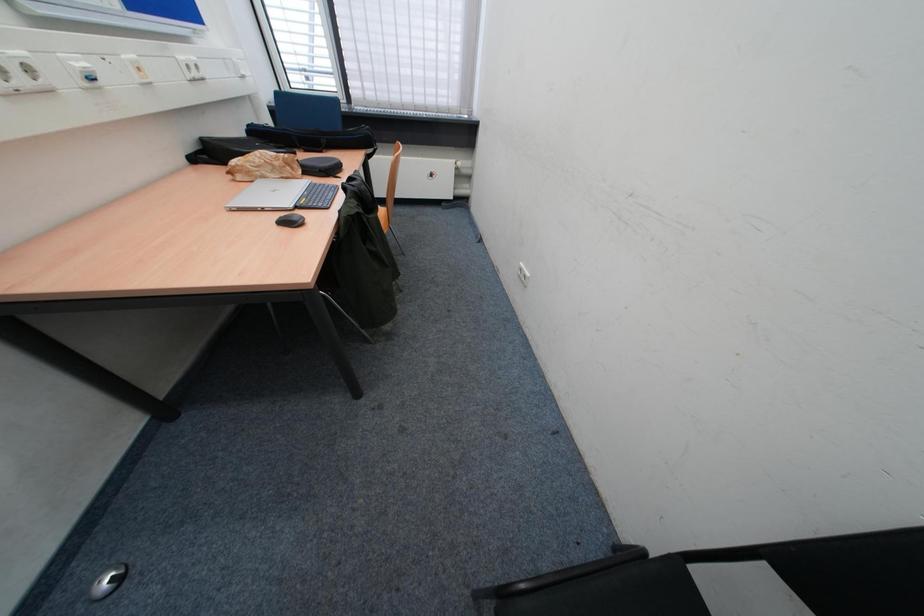
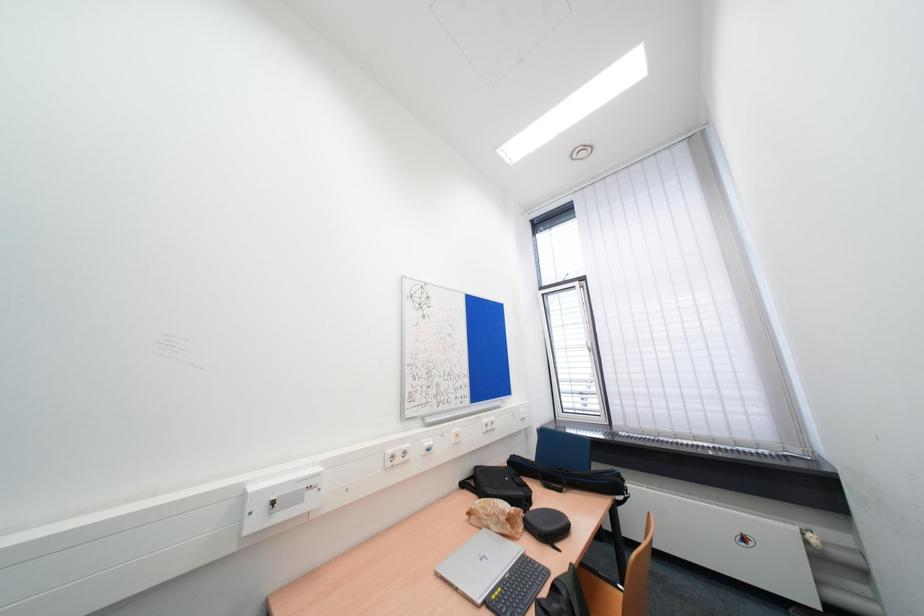
Looking at this image, how did the camera likely rotate?

The camera's rotation is toward left-up.